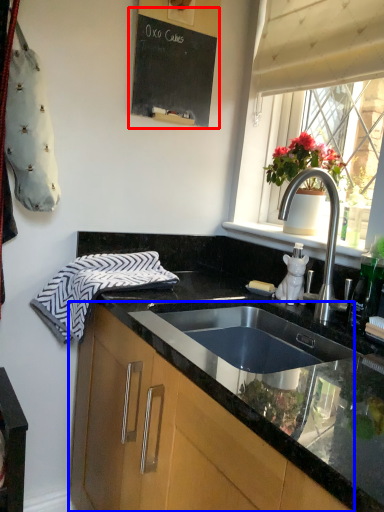
Question: Which of the following is the closest to the observer, bulletin board (highlighted by a red box) or cabinetry (highlighted by a blue box)?

Choices:
 (A) bulletin board
 (B) cabinetry

Answer: (B)